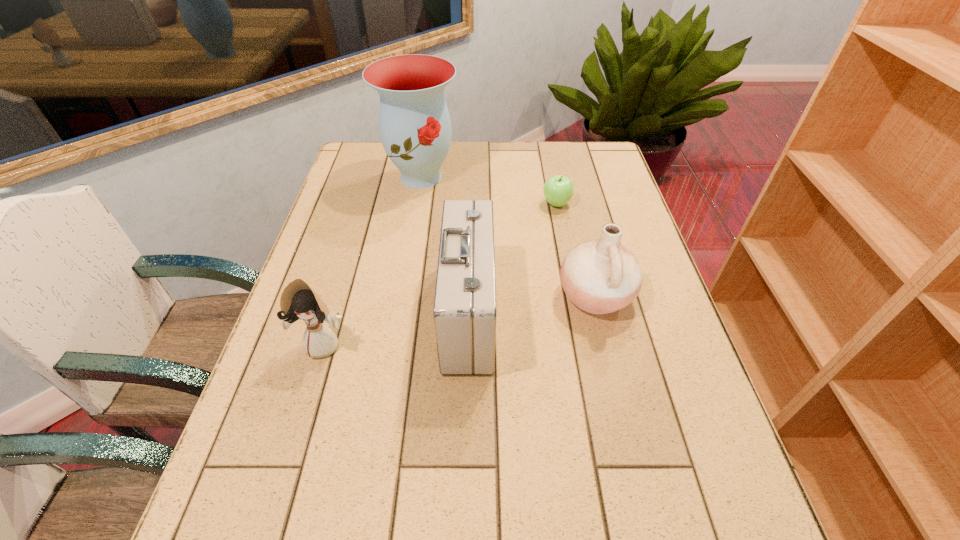
You are a GUI agent. You are given a task and a screenshot of the screen. Output one action in this format:
    pyautogui.click(x=<x>, y=<y>)
    Task: Click on the tallest object
    The image size is (960, 540).
    Given the screenshot: What is the action you would take?
    pyautogui.click(x=415, y=128)

The height and width of the screenshot is (540, 960). What are the coordinates of `the first-aid kit` in the screenshot? It's located at (464, 313).

Identify the location of pottery. (600, 276).

Where is `doll`? doll is located at coordinates (299, 301).

At what (x,y) coordinates should I click in order to perform the action: click on apple. Please return your answer as a coordinate pair (x, y). This screenshot has width=960, height=540. Looking at the image, I should click on (558, 190).

In order to click on vacant space located on the right of the vase in this screenshot , I will do `click(488, 177)`.

Find the location of a particular element. blank space located 0.230m on the front-facing side of the first-aid kit is located at coordinates (589, 313).

The width and height of the screenshot is (960, 540). I want to click on vacant space situated 0.190m to pour from the handle of the pottery, so click(x=480, y=295).

Locate an element on the screen. The width and height of the screenshot is (960, 540). vacant position located 0.310m to pour from the handle of the pottery is located at coordinates (431, 295).

Where is `free spot located 0.280m to pour from the handle of the pottery`? The width and height of the screenshot is (960, 540). free spot located 0.280m to pour from the handle of the pottery is located at coordinates (443, 295).